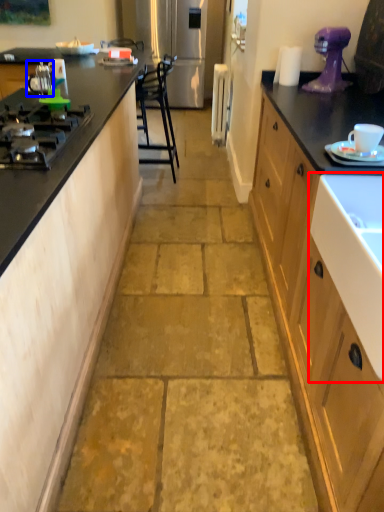
Question: Which point is further to the camera, sink (highlighted by a red box) or appliance (highlighted by a blue box)?

Choices:
 (A) sink
 (B) appliance

Answer: (B)